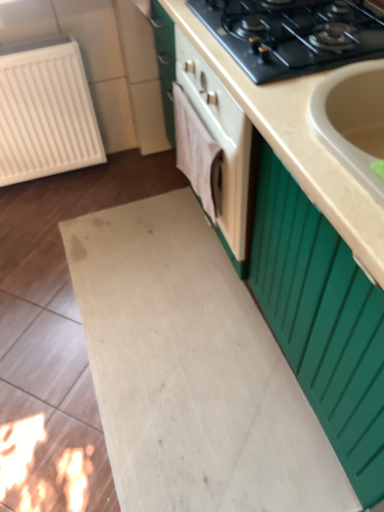
Question: Is black matte gas stove at upper center completely or partially outside of beige matte countertop at center?

Choices:
 (A) yes
 (B) no

Answer: (B)

Question: Is beige matte countertop at center located within black matte gas stove at upper center?

Choices:
 (A) no
 (B) yes

Answer: (A)

Question: Considering the relative sizes of black matte gas stove at upper center and beige matte countertop at center in the image provided, is black matte gas stove at upper center wider than beige matte countertop at center?

Choices:
 (A) no
 (B) yes

Answer: (A)

Question: Are black matte gas stove at upper center and beige matte countertop at center far apart?

Choices:
 (A) yes
 (B) no

Answer: (B)

Question: From a real-world perspective, is black matte gas stove at upper center located beneath beige matte countertop at center?

Choices:
 (A) yes
 (B) no

Answer: (B)

Question: Is black matte gas stove at upper center oriented towards beige matte countertop at center?

Choices:
 (A) yes
 (B) no

Answer: (B)

Question: Considering the relative sizes of beige matte countertop at center and black matte gas stove at upper center in the image provided, is beige matte countertop at center taller than black matte gas stove at upper center?

Choices:
 (A) yes
 (B) no

Answer: (A)

Question: Does beige matte countertop at center have a greater width compared to black matte gas stove at upper center?

Choices:
 (A) no
 (B) yes

Answer: (B)

Question: Is the depth of beige matte countertop at center less than that of black matte gas stove at upper center?

Choices:
 (A) yes
 (B) no

Answer: (A)

Question: Does beige matte countertop at center appear on the left side of black matte gas stove at upper center?

Choices:
 (A) no
 (B) yes

Answer: (A)

Question: Is beige matte countertop at center touching black matte gas stove at upper center?

Choices:
 (A) yes
 (B) no

Answer: (B)

Question: From a real-world perspective, is beige matte countertop at center physically below black matte gas stove at upper center?

Choices:
 (A) no
 (B) yes

Answer: (B)

Question: Considering the relative sizes of white plastic radiator at left and beige matte countertop at center in the image provided, is white plastic radiator at left smaller than beige matte countertop at center?

Choices:
 (A) no
 (B) yes

Answer: (B)